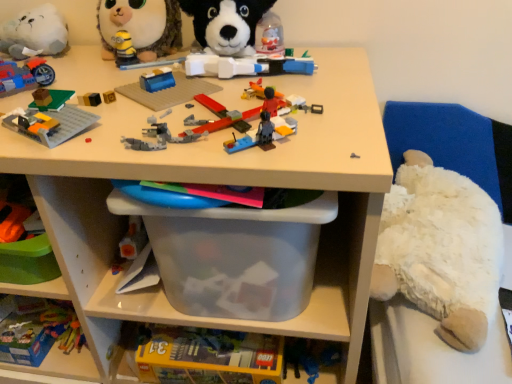
Question: Is matte blue motorcycle at upper left, the 3th toy positioned from the left, bigger or smaller than translucent plastic baseplate at upper left, the fifth toy from the right?

Choices:
 (A) big
 (B) small

Answer: (B)

Question: Is point (36, 59) positioned closer to the camera than point (54, 130)?

Choices:
 (A) farther
 (B) closer

Answer: (A)

Question: Considering the real-world distances, which object is closest to the white fluffy teddy bear at right, placed as the 8th toy when sorted from left to right?

Choices:
 (A) translucent plastic baseplate at upper left, the fifth toy from the right
 (B) fluffy plush toy at upper left, the fourth toy in the right-to-left sequence
 (C) white plush dog at upper center, the seventh toy viewed from the left
 (D) translucent plastic lego box at lower left, the 8th toy positioned from the right
 (E) white plush cat at upper left, acting as the 2th toy starting from the left

Answer: (C)

Question: Which is farther from the fluffy plush toy at upper left, the fifth toy positioned from the left?

Choices:
 (A) translucent plastic baseplate at upper left, the fifth toy from the right
 (B) translucent plastic lego box at lower left, the first toy when ordered from left to right
 (C) white plush at right
 (D) white plush cat at upper left, acting as the 2th toy starting from the left
 (E) clear plastic bin at center

Answer: (C)